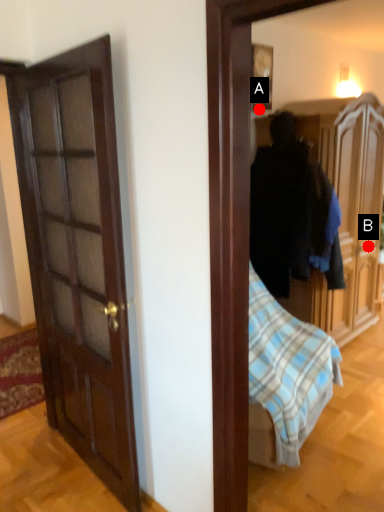
Question: Two points are circled on the image, labeled by A and B beside each circle. Which point is further to the camera?

Choices:
 (A) A is further
 (B) B is further

Answer: (B)